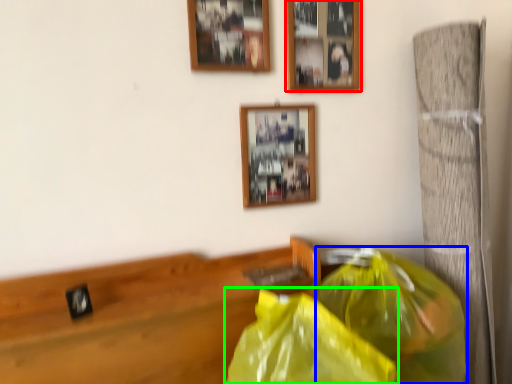
Question: Which object is the closest to the picture frame (highlighted by a red box)? Choose among these: plastic bag (highlighted by a blue box) or plastic bag (highlighted by a green box).

Choices:
 (A) plastic bag
 (B) plastic bag

Answer: (A)